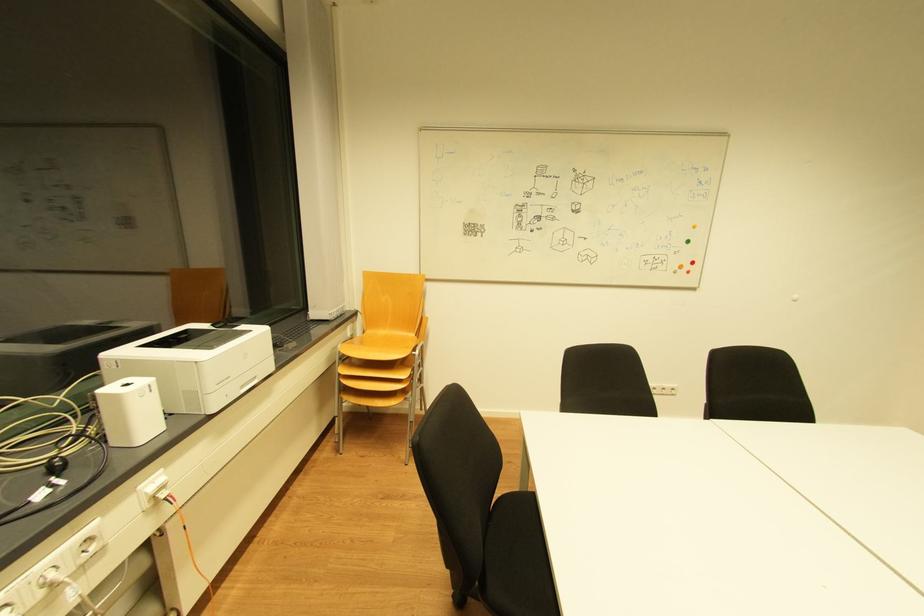
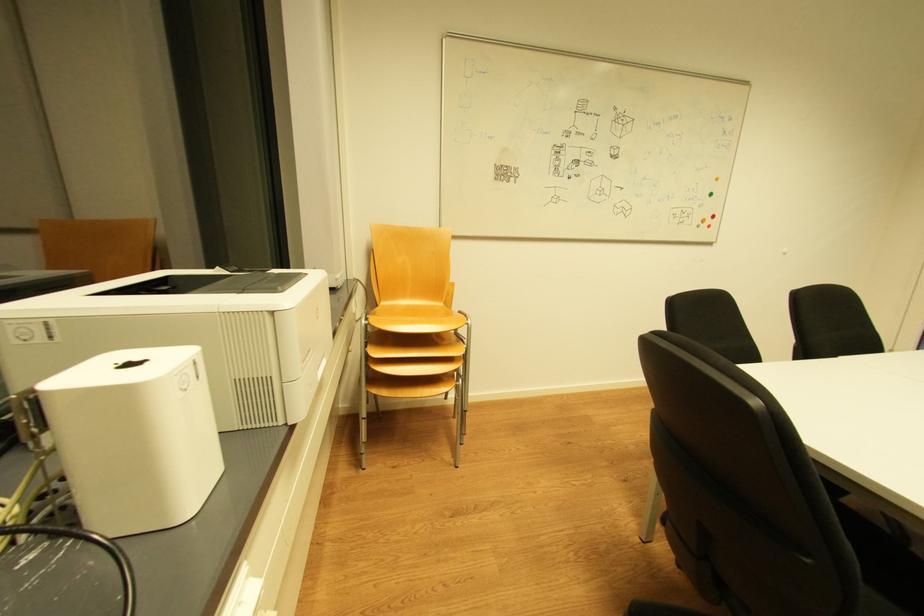
Question: The first image is from the beginning of the video and the second image is from the end. How did the camera likely rotate when shooting the video?

Choices:
 (A) Left
 (B) Right
 (C) Up
 (D) Down

Answer: (B)